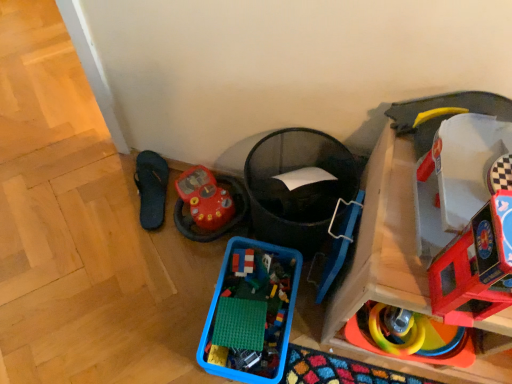
Where is `empty space that is to the right of translucent plastic bricks at center, which is counted as the fifth toy, starting from the right`? The image size is (512, 384). empty space that is to the right of translucent plastic bricks at center, which is counted as the fifth toy, starting from the right is located at coordinates (272, 273).